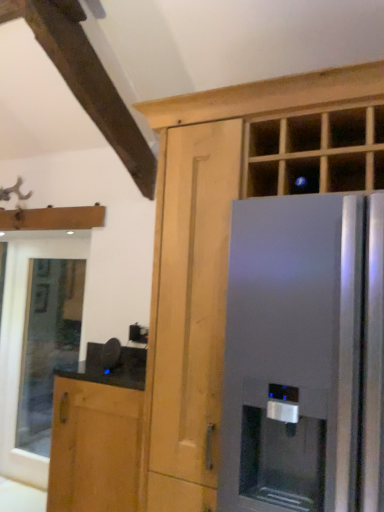
Question: Should I look upward or downward to see clear glass window at lower left?

Choices:
 (A) down
 (B) up

Answer: (A)

Question: Is matte wood cabinet at center, which is the first cabinetry from right to left, outside clear glass window at lower left?

Choices:
 (A) yes
 (B) no

Answer: (A)

Question: Considering the relative sizes of matte wood cabinet at center, which is the first cabinetry from right to left, and clear glass window at lower left in the image provided, is matte wood cabinet at center, which is the first cabinetry from right to left, bigger than clear glass window at lower left?

Choices:
 (A) yes
 (B) no

Answer: (A)

Question: Could you tell me if matte wood cabinet at center, which is the first cabinetry from right to left, is facing clear glass window at lower left?

Choices:
 (A) no
 (B) yes

Answer: (A)

Question: Can you confirm if matte wood cabinet at center, which is the first cabinetry from right to left, is shorter than clear glass window at lower left?

Choices:
 (A) yes
 (B) no

Answer: (A)

Question: Is matte wood cabinet at center, marked as the 2th cabinetry in a left-to-right arrangement, next to clear glass window at lower left?

Choices:
 (A) no
 (B) yes

Answer: (A)

Question: From the image's perspective, is matte wood cabinet at center, marked as the 2th cabinetry in a left-to-right arrangement, on top of clear glass window at lower left?

Choices:
 (A) yes
 (B) no

Answer: (A)

Question: Does brown wood cabinet at lower left, acting as the 1th cabinetry starting from the left, come behind clear glass window at lower left?

Choices:
 (A) no
 (B) yes

Answer: (A)

Question: Is brown wood cabinet at lower left, acting as the 1th cabinetry starting from the left, next to clear glass window at lower left?

Choices:
 (A) no
 (B) yes

Answer: (A)

Question: Considering the relative sizes of brown wood cabinet at lower left, which ranks as the 2th cabinetry in right-to-left order, and clear glass window at lower left in the image provided, is brown wood cabinet at lower left, which ranks as the 2th cabinetry in right-to-left order, shorter than clear glass window at lower left?

Choices:
 (A) yes
 (B) no

Answer: (A)

Question: Is brown wood cabinet at lower left, acting as the 1th cabinetry starting from the left, oriented towards clear glass window at lower left?

Choices:
 (A) yes
 (B) no

Answer: (B)

Question: Is the position of brown wood cabinet at lower left, which ranks as the 2th cabinetry in right-to-left order, less distant than that of clear glass window at lower left?

Choices:
 (A) no
 (B) yes

Answer: (B)

Question: Can you confirm if brown wood cabinet at lower left, which ranks as the 2th cabinetry in right-to-left order, is wider than clear glass window at lower left?

Choices:
 (A) no
 (B) yes

Answer: (B)

Question: Does satin silver refrigerator at right have a smaller size compared to brown wood cabinet at lower left, acting as the 1th cabinetry starting from the left?

Choices:
 (A) no
 (B) yes

Answer: (A)